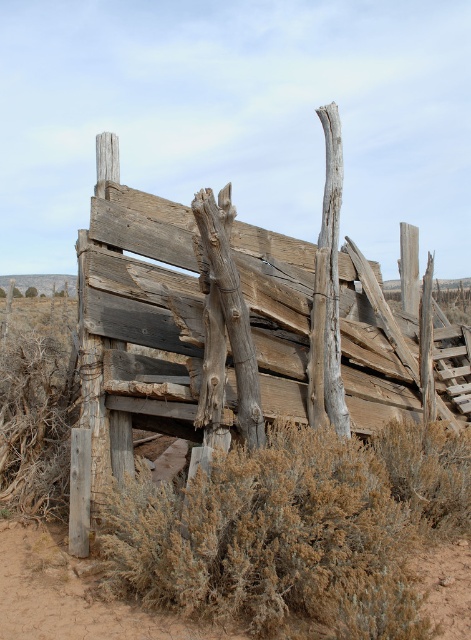
Question: From the image, what is the correct spatial relationship of weathered wood fence at center in relation to brown dry bush at lower center?

Choices:
 (A) above
 (B) below

Answer: (A)

Question: Can you confirm if weathered wood fence at center is positioned to the left of brown dry bush at lower center?

Choices:
 (A) no
 (B) yes

Answer: (B)

Question: Which point is farther to the camera?

Choices:
 (A) brown dry bush at lower center
 (B) weathered wood fence at center

Answer: (B)

Question: Which of the following is the closest to the observer?

Choices:
 (A) (143, 330)
 (B) (389, 600)

Answer: (B)

Question: Is weathered wood fence at center positioned behind brown dry bush at lower center?

Choices:
 (A) yes
 (B) no

Answer: (A)